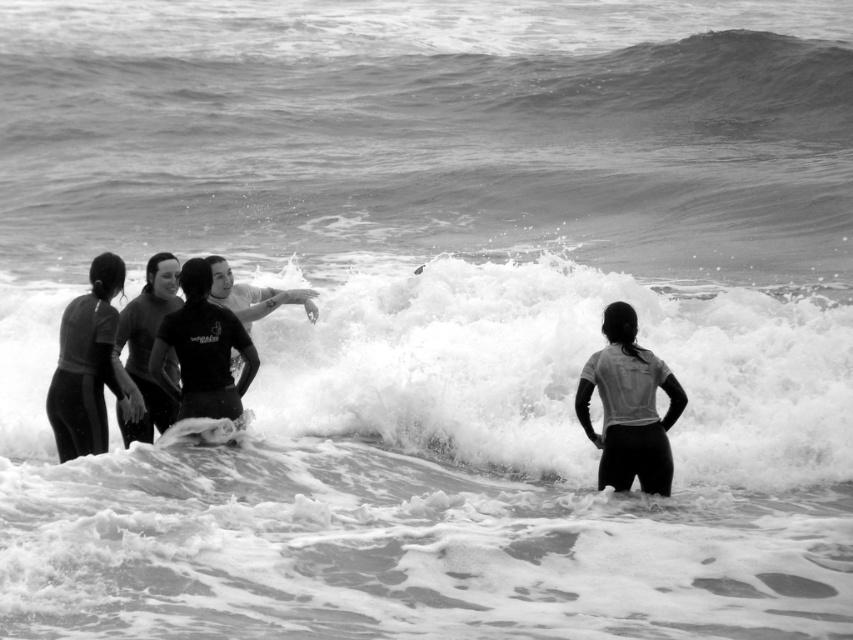
This screenshot has height=640, width=853. What are the coordinates of `light gray matte wetsuit at right` in the screenshot? It's located at pyautogui.click(x=630, y=417).

Does point (679, 410) lie behind point (169, 328)?

No, (679, 410) is closer to viewer.

This screenshot has height=640, width=853. Find the location of `light gray matte wetsuit at right`. light gray matte wetsuit at right is located at coordinates (630, 417).

Which is above, white frothy wave at center or light gray matte wetsuit at right?

white frothy wave at center is higher up.

Between white frothy wave at center and light gray matte wetsuit at right, which one appears on the right side from the viewer's perspective?

light gray matte wetsuit at right

Image resolution: width=853 pixels, height=640 pixels. What do you see at coordinates (561, 371) in the screenshot?
I see `white frothy wave at center` at bounding box center [561, 371].

Where is `white frothy wave at center`? This screenshot has height=640, width=853. white frothy wave at center is located at coordinates (561, 371).

Which is above, black matte wetsuit at left or dark gray matte wetsuit at center-left?

Positioned higher is dark gray matte wetsuit at center-left.

Is point (91, 372) less distant than point (164, 422)?

Yes, it is in front of point (164, 422).

Where is `black matte wetsuit at left`? black matte wetsuit at left is located at coordinates (83, 376).

Where is `black matte wetsuit at left`? black matte wetsuit at left is located at coordinates (83, 376).